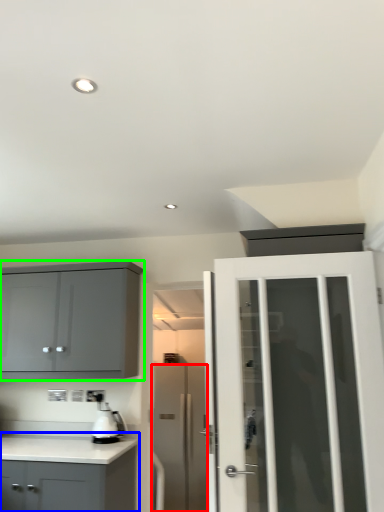
Question: Considering the real-world distances, which object is farthest from door (highlighted by a red box)? cabinetry (highlighted by a blue box) or cabinetry (highlighted by a green box)?

Choices:
 (A) cabinetry
 (B) cabinetry

Answer: (B)